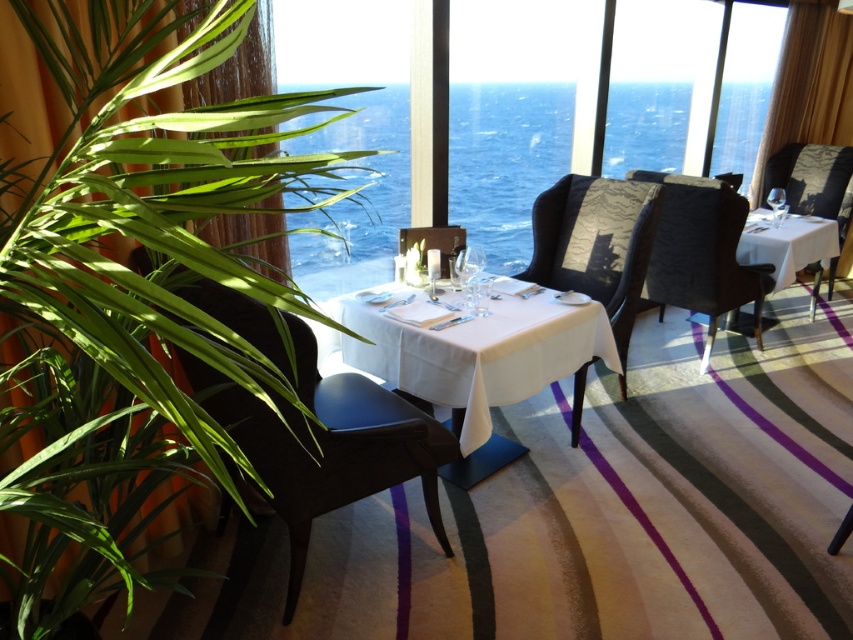
You are a server carrying a tray of drinks and need to navigate between the satin black chair at center and the matte black chair at center. What is the minimum distance you need to maintain to avoid bumping into either chair?

The satin black chair at center and the matte black chair at center are 27.67 inches apart from each other. To avoid bumping into either chair, you should maintain a distance of at least 27.67 inches between them while navigating.

You are standing in the dining area and want to walk from point A to point B. Point A is at coordinate point (x=643, y=248) and point B is at coordinate point (x=447, y=240). Since you can only move forward, will you be moving towards the tables or away from them?

Point A at coordinate point (x=643, y=248) is further to the camera than point B at coordinate point (x=447, y=240). Therefore, moving from point A to point B means you are moving towards the tables.

You are standing at the origin point in the dining room and want to move towards the satin black chair at center. What are the coordinates you need to navigate to in order to reach it?

The coordinates to navigate to are 0.383 on the x axis and 0.700 on the y axis to reach the satin black chair at center.